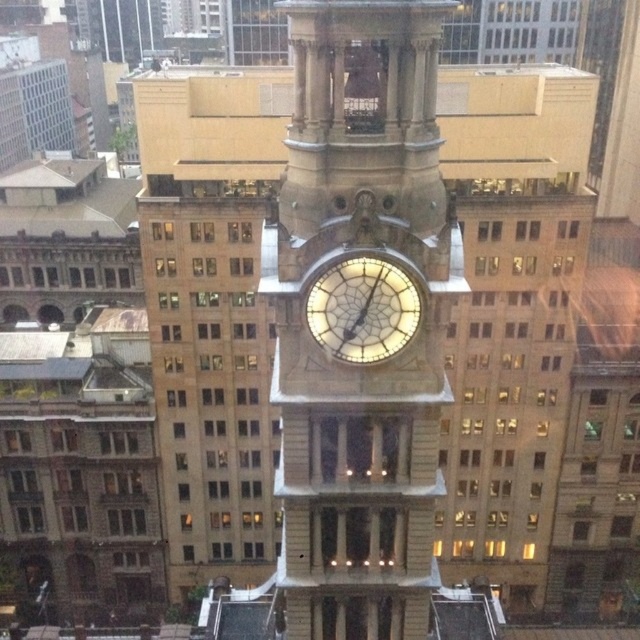
In the scene shown: Between golden stone clock tower at center and illuminated glass clock at center, which one has more height?

Standing taller between the two is golden stone clock tower at center.

Between point (333, 499) and point (336, 282), which one is positioned in front?

Point (336, 282)

Locate an element on the screen. This screenshot has width=640, height=640. golden stone clock tower at center is located at coordinates click(x=360, y=317).